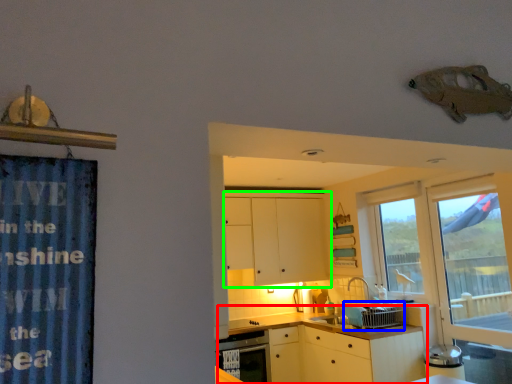
Question: Based on their relative distances, which object is nearer to counter top (highlighted by a red box)? Choose from appliance (highlighted by a blue box) and cabinetry (highlighted by a green box).

Choices:
 (A) appliance
 (B) cabinetry

Answer: (A)